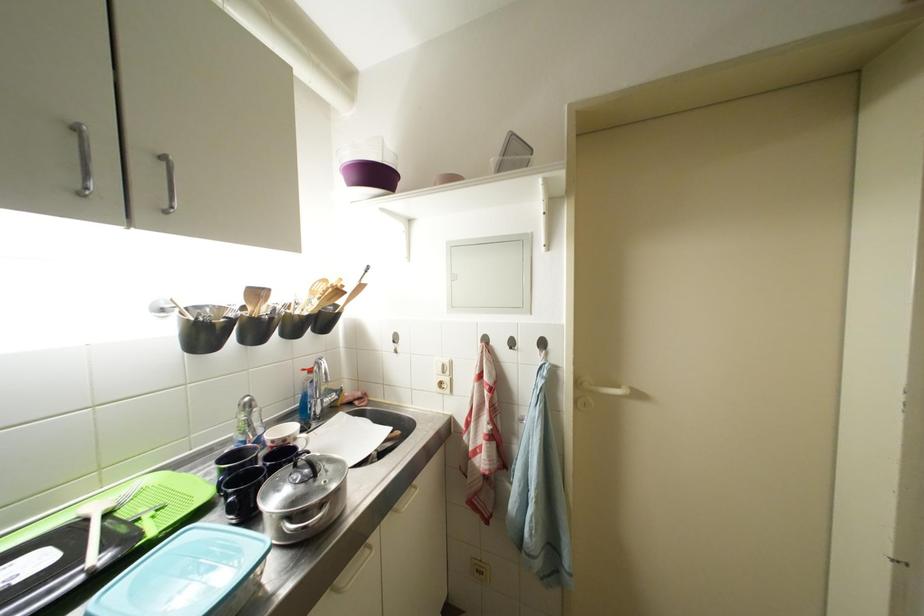
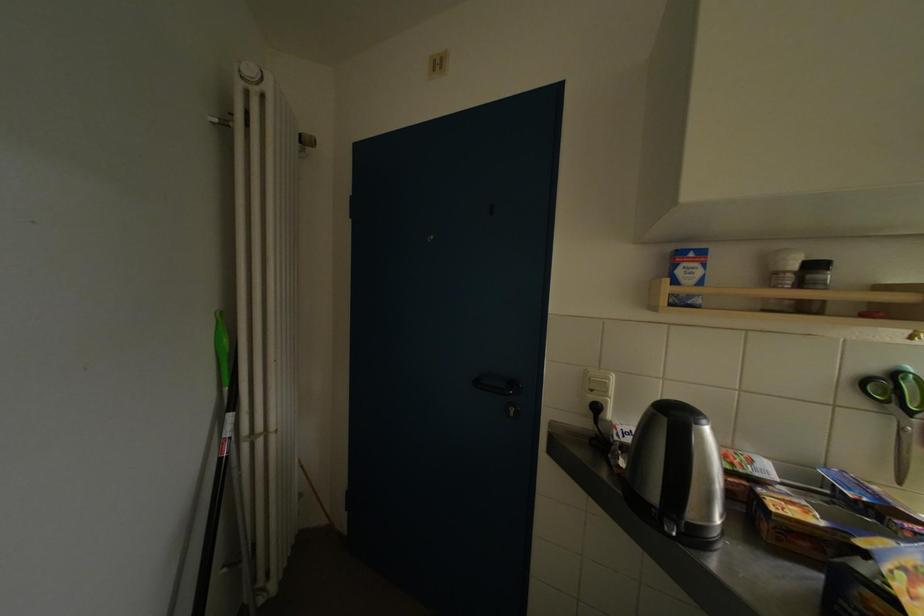
Question: The camera is either moving clockwise (left) or counter-clockwise (right) around the object. The first image is from the beginning of the video and the second image is from the end. Is the camera moving left or right when shooting the video?

Choices:
 (A) Left
 (B) Right

Answer: (B)